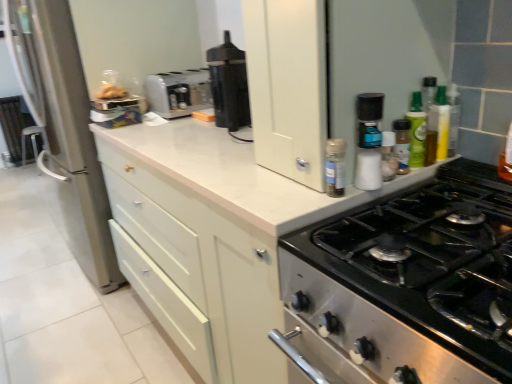
The height and width of the screenshot is (384, 512). Find the location of `free space to the left of white plastic salt shaker at upper right, marked as the 1th bottle in a left-to-right arrangement`. free space to the left of white plastic salt shaker at upper right, marked as the 1th bottle in a left-to-right arrangement is located at coordinates (288, 192).